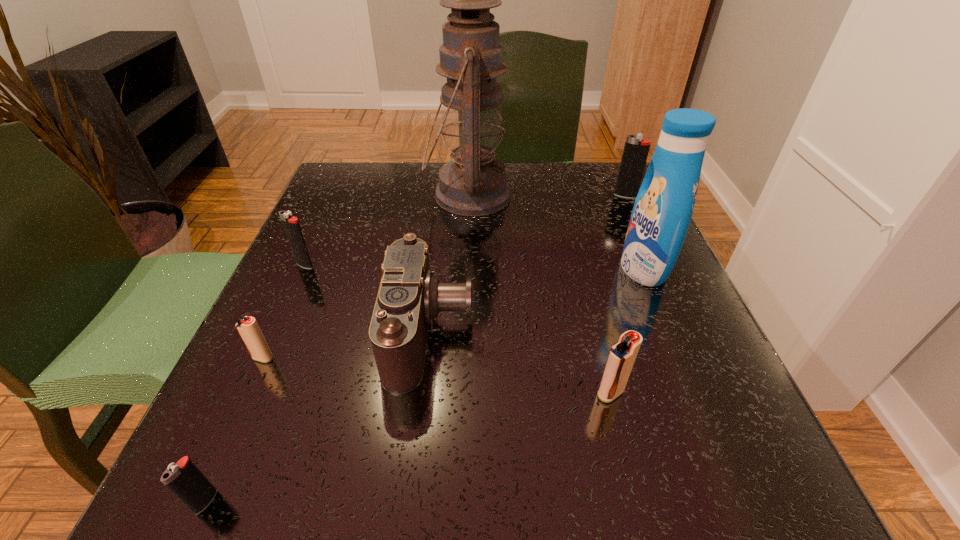
Find the location of a particular element. the tallest object is located at coordinates (473, 183).

Find the location of a particular element. This screenshot has height=540, width=960. oil lamp is located at coordinates (473, 183).

The image size is (960, 540). What are the coordinates of `detergent` in the screenshot? It's located at (663, 208).

Locate an element on the screen. Image resolution: width=960 pixels, height=540 pixels. the farthest black igniter is located at coordinates (x=636, y=149).

At what (x,y) coordinates should I click in order to perform the action: click on the rightmost igniter. Please return your answer as a coordinate pair (x, y). Looking at the image, I should click on (636, 149).

Find the location of `camera`. camera is located at coordinates (409, 298).

I want to click on the fourth nearest igniter, so 291,225.

You are a GUI agent. You are given a task and a screenshot of the screen. Output one action in this format:
    pyautogui.click(x=<x>, y=<y>)
    Task: Click on the second nearest black igniter
    
    Given the screenshot: What is the action you would take?
    pyautogui.click(x=291, y=225)

Find the location of `the third object from right to left`. the third object from right to left is located at coordinates (622, 356).

You are a GUI agent. You are given a task and a screenshot of the screen. Output one action in this format:
    pyautogui.click(x=<x>, y=<y>)
    Task: Click on the second igniter from right to left
    Image resolution: width=960 pixels, height=540 pixels.
    Given the screenshot: What is the action you would take?
    pyautogui.click(x=622, y=356)